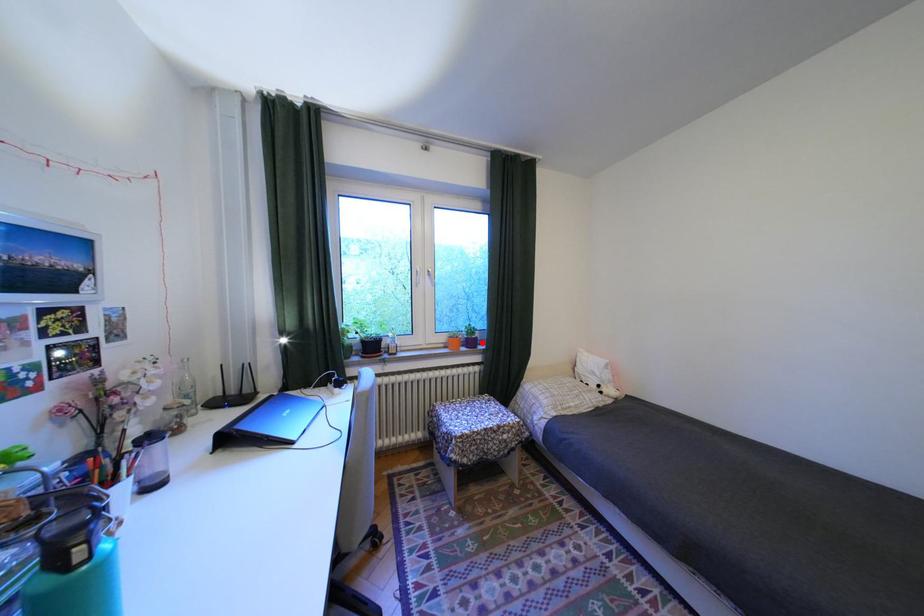
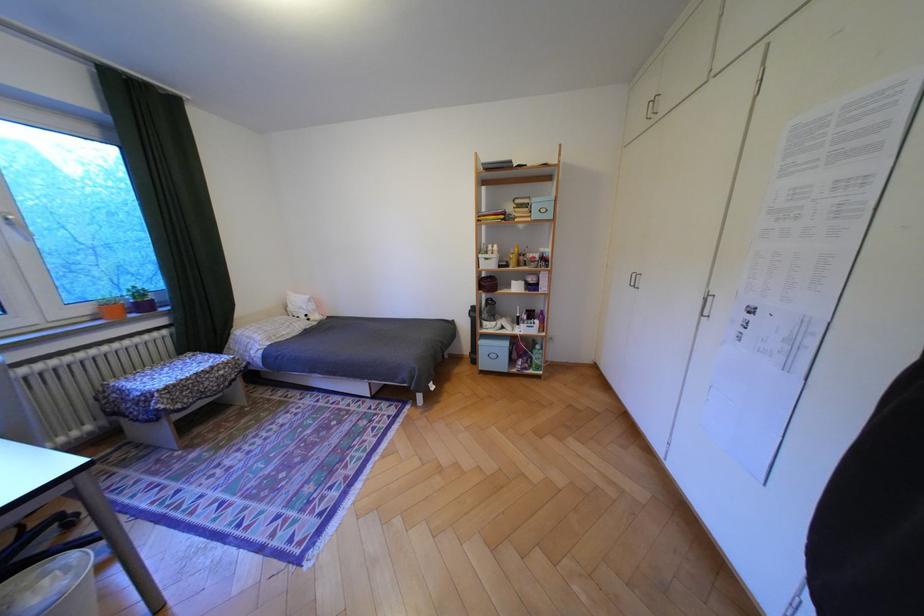
Find the pixel in the second image that matches the highlighted location in the first image.

(155, 307)